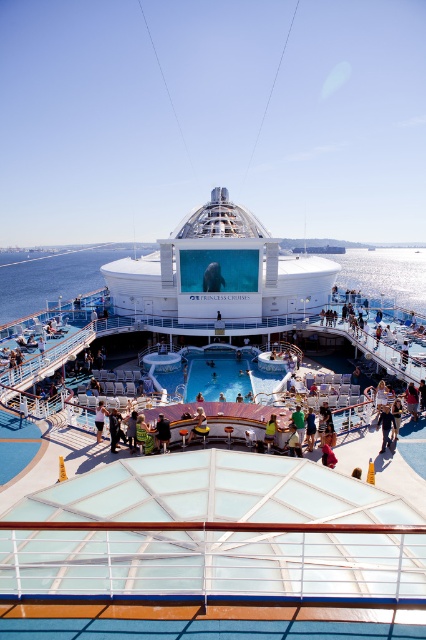
Can you confirm if dark brown leather jacket at center is positioned to the right of tan leather jacket at center?

Incorrect, dark brown leather jacket at center is not on the right side of tan leather jacket at center.

At what (x,y) coordinates should I click in order to perform the action: click on dark brown leather jacket at center. Please return your answer as a coordinate pair (x, y). The image size is (426, 640). Looking at the image, I should click on (161, 433).

Between dark blue jeans at center and dark blue fabric shorts at center, which one appears on the left side from the viewer's perspective?

dark blue fabric shorts at center

Is point (414, 416) positioned in front of point (97, 440)?

No, it is not.

Locate an element on the screen. The image size is (426, 640). dark blue jeans at center is located at coordinates (411, 401).

Where is `dark blue jeans at center`? dark blue jeans at center is located at coordinates (411, 401).

Which is above, black fabric person at center or dark blue fabric shorts at center?

black fabric person at center is above.

In the scene shown: Does black fabric person at center lie in front of dark blue fabric shorts at center?

Yes, black fabric person at center is in front of dark blue fabric shorts at center.

Identify the location of black fabric person at center. tap(385, 426).